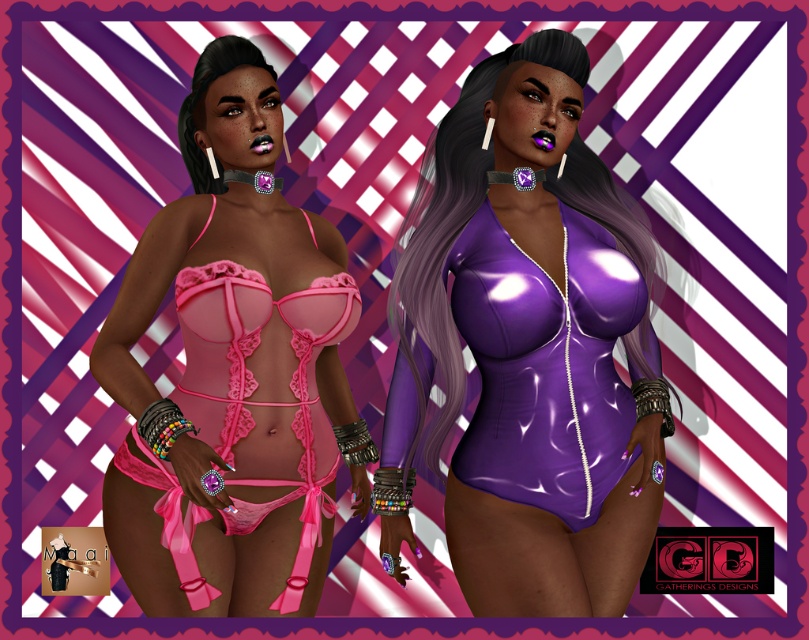
You are an art director analyzing the composition of this image. Which object is positioned to the right side of the other between the shiny purple bodysuit at right and the matte pink lingerie at upper left?

The shiny purple bodysuit at right is positioned to the right of the matte pink lingerie at upper left according to the description.